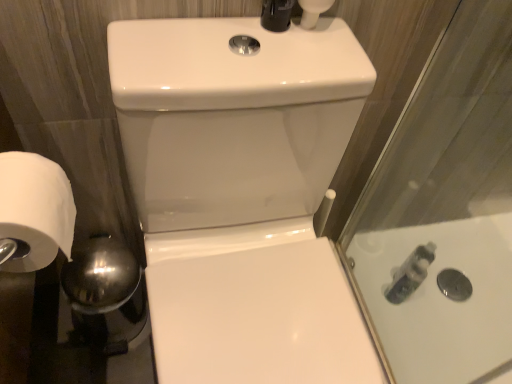
Question: Is white glossy sink at center thinner than translucent plastic bottle at right?

Choices:
 (A) no
 (B) yes

Answer: (A)

Question: Can you confirm if white glossy sink at center is positioned to the right of translucent plastic bottle at right?

Choices:
 (A) yes
 (B) no

Answer: (B)

Question: Can you confirm if white glossy sink at center is bigger than translucent plastic bottle at right?

Choices:
 (A) yes
 (B) no

Answer: (A)

Question: Is white glossy sink at center smaller than translucent plastic bottle at right?

Choices:
 (A) no
 (B) yes

Answer: (A)

Question: Are white glossy sink at center and translucent plastic bottle at right located far from each other?

Choices:
 (A) yes
 (B) no

Answer: (B)

Question: Is white glossy sink at center taller or shorter than white matte toilet paper at left?

Choices:
 (A) short
 (B) tall

Answer: (B)

Question: Based on their positions, is white glossy sink at center located to the left or right of white matte toilet paper at left?

Choices:
 (A) right
 (B) left

Answer: (A)

Question: Looking at their shapes, would you say white glossy sink at center is wider or thinner than white matte toilet paper at left?

Choices:
 (A) wide
 (B) thin

Answer: (A)

Question: Is white glossy sink at center situated inside white matte toilet paper at left or outside?

Choices:
 (A) outside
 (B) inside

Answer: (A)

Question: Visually, is translucent plastic bottle at right positioned to the left or to the right of white glossy sink at center?

Choices:
 (A) left
 (B) right

Answer: (B)

Question: Does point (396, 297) appear closer or farther from the camera than point (218, 249)?

Choices:
 (A) closer
 (B) farther

Answer: (B)

Question: Is translucent plastic bottle at right situated inside white glossy sink at center or outside?

Choices:
 (A) outside
 (B) inside

Answer: (A)

Question: Is translucent plastic bottle at right in front of or behind white glossy sink at center in the image?

Choices:
 (A) behind
 (B) front

Answer: (A)

Question: Relative to translucent plastic bottle at right, is white matte toilet paper at left in front or behind?

Choices:
 (A) behind
 (B) front

Answer: (B)

Question: From a real-world perspective, is white matte toilet paper at left physically located above or below translucent plastic bottle at right?

Choices:
 (A) below
 (B) above

Answer: (B)